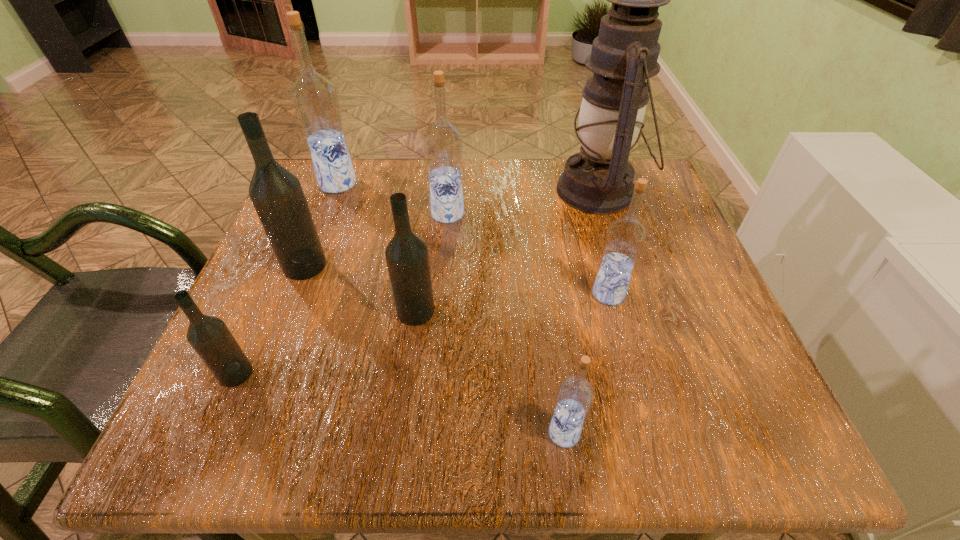
This screenshot has height=540, width=960. I want to click on blue vodka that is the third closest to the biggest blue vodka, so click(x=575, y=395).

Where is `black vodka object that ranks as the second closest to the nearest vodka`? The image size is (960, 540). black vodka object that ranks as the second closest to the nearest vodka is located at coordinates (209, 336).

Locate an element on the screen. This screenshot has height=540, width=960. black vodka that is the second closest to the third smallest blue vodka is located at coordinates (277, 195).

Identify the location of vacant space that satisfies the following two spatial constraints: 1. on the front side of the rightmost black vodka; 2. on the right side of the biggest black vodka. This screenshot has height=540, width=960. pyautogui.click(x=287, y=311).

The height and width of the screenshot is (540, 960). Find the location of `blank area in the image that satisfies the following two spatial constraints: 1. on the back side of the second farthest blue vodka; 2. on the right side of the sixth farthest vodka`. blank area in the image that satisfies the following two spatial constraints: 1. on the back side of the second farthest blue vodka; 2. on the right side of the sixth farthest vodka is located at coordinates (306, 214).